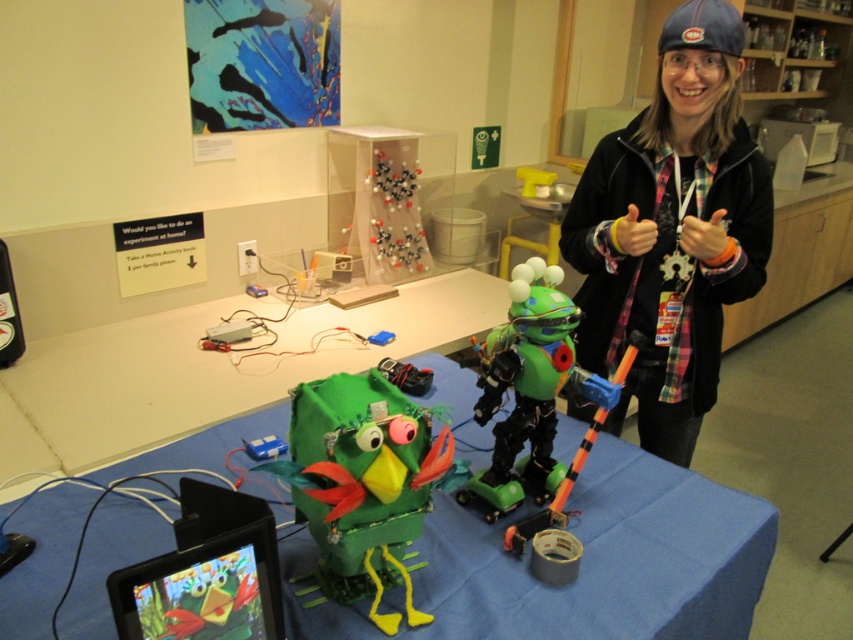
You are a visitor at the science fair and want to take a photo of both the green cardboard table at center and the green matte robot at center. Which one should you focus on first if you want to capture both in the same frame without moving the camera?

The green cardboard table at center is taller than the green matte robot at center, so you should focus on the green cardboard table at center first to ensure both are in frame.